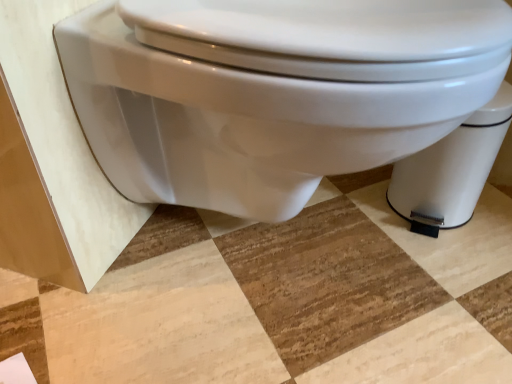
The height and width of the screenshot is (384, 512). What are the coordinates of `white glossy toilet bowl at lower right` in the screenshot? It's located at (451, 170).

The image size is (512, 384). What do you see at coordinates (451, 170) in the screenshot? I see `white glossy toilet bowl at lower right` at bounding box center [451, 170].

Image resolution: width=512 pixels, height=384 pixels. Describe the element at coordinates (272, 92) in the screenshot. I see `white glossy toilet at center` at that location.

You are a GUI agent. You are given a task and a screenshot of the screen. Output one action in this format:
    pyautogui.click(x=<x>, y=<y>)
    Task: Click on the white glossy toilet at center
    
    Given the screenshot: What is the action you would take?
    pyautogui.click(x=272, y=92)

Locate an element on the screen. This screenshot has width=512, height=384. white glossy toilet bowl at lower right is located at coordinates (451, 170).

Does white glossy toilet at center appear on the left side of white glossy toilet bowl at lower right?

Yes.

Is white glossy toilet at center in front of or behind white glossy toilet bowl at lower right in the image?

white glossy toilet at center is positioned closer to the viewer than white glossy toilet bowl at lower right.

Does point (283, 144) appear closer or farther from the camera than point (416, 220)?

Point (283, 144) is positioned closer to the camera compared to point (416, 220).

From the image's perspective, does white glossy toilet at center appear lower than white glossy toilet bowl at lower right?

Actually, white glossy toilet at center appears above white glossy toilet bowl at lower right in the image.

From a real-world perspective, who is located lower, white glossy toilet at center or white glossy toilet bowl at lower right?

white glossy toilet bowl at lower right.

Looking at their sizes, would you say white glossy toilet at center is wider or thinner than white glossy toilet bowl at lower right?

In the image, white glossy toilet at center appears to be wider than white glossy toilet bowl at lower right.

Considering the sizes of white glossy toilet at center and white glossy toilet bowl at lower right in the image, is white glossy toilet at center taller or shorter than white glossy toilet bowl at lower right?

Clearly, white glossy toilet at center is taller compared to white glossy toilet bowl at lower right.

Between white glossy toilet at center and white glossy toilet bowl at lower right, which one has larger size?

white glossy toilet at center.

Could white glossy toilet bowl at lower right be considered to be inside white glossy toilet at center?

No.

Is white glossy toilet at center beside white glossy toilet bowl at lower right?

No, white glossy toilet at center is not with white glossy toilet bowl at lower right.

Is white glossy toilet at center oriented towards white glossy toilet bowl at lower right?

No, white glossy toilet at center is not aimed at white glossy toilet bowl at lower right.

How many degrees apart are the facing directions of white glossy toilet at center and white glossy toilet bowl at lower right?

0.00158 degrees separate the facing orientations of white glossy toilet at center and white glossy toilet bowl at lower right.

The height and width of the screenshot is (384, 512). I want to click on toilet bowl that is behind the white glossy toilet at center, so click(x=451, y=170).

Does white glossy toilet bowl at lower right appear on the left side of white glossy toilet at center?

No, white glossy toilet bowl at lower right is not to the left of white glossy toilet at center.

Is white glossy toilet bowl at lower right in front of or behind white glossy toilet at center in the image?

Visually, white glossy toilet bowl at lower right is located behind white glossy toilet at center.

Considering the points (459, 209) and (170, 53), which point is in front, point (459, 209) or point (170, 53)?

Point (170, 53)

From the image's perspective, is white glossy toilet bowl at lower right located above or below white glossy toilet at center?

From the image's perspective, white glossy toilet bowl at lower right appears below white glossy toilet at center.

From a real-world perspective, is white glossy toilet bowl at lower right positioned above or below white glossy toilet at center?

white glossy toilet bowl at lower right is situated lower than white glossy toilet at center in the real world.

Does white glossy toilet bowl at lower right have a lesser width compared to white glossy toilet at center?

Correct, the width of white glossy toilet bowl at lower right is less than that of white glossy toilet at center.

Which of these two, white glossy toilet bowl at lower right or white glossy toilet at center, stands taller?

white glossy toilet at center is taller.

From the picture: Considering the sizes of objects white glossy toilet bowl at lower right and white glossy toilet at center in the image provided, who is bigger, white glossy toilet bowl at lower right or white glossy toilet at center?

white glossy toilet at center is bigger.

Is white glossy toilet at center surrounded by white glossy toilet bowl at lower right?

No, white glossy toilet at center is not inside white glossy toilet bowl at lower right.

Are white glossy toilet bowl at lower right and white glossy toilet at center located far from each other?

No, white glossy toilet bowl at lower right is not far from white glossy toilet at center.

Does white glossy toilet bowl at lower right turn towards white glossy toilet at center?

No, white glossy toilet bowl at lower right is not aimed at white glossy toilet at center.

How different are the orientations of white glossy toilet bowl at lower right and white glossy toilet at center in degrees?

The angular difference between white glossy toilet bowl at lower right and white glossy toilet at center is 0.00158 degrees.

You are a GUI agent. You are given a task and a screenshot of the screen. Output one action in this format:
    pyautogui.click(x=<x>, y=<y>)
    Task: Click on the toilet located in front of the white glossy toilet bowl at lower right
    
    Given the screenshot: What is the action you would take?
    pyautogui.click(x=272, y=92)

At what (x,y) coordinates should I click in order to perform the action: click on toilet on the left side of white glossy toilet bowl at lower right. Please return your answer as a coordinate pair (x, y). The width and height of the screenshot is (512, 384). Looking at the image, I should click on (272, 92).

The width and height of the screenshot is (512, 384). Identify the location of toilet bowl lying below the white glossy toilet at center (from the image's perspective). (451, 170).